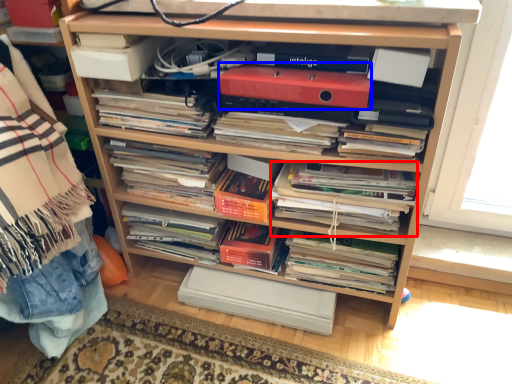
Question: Which of the following is the closest to the observer, magazine (highlighted by a red box) or paperback book (highlighted by a blue box)?

Choices:
 (A) magazine
 (B) paperback book

Answer: (B)